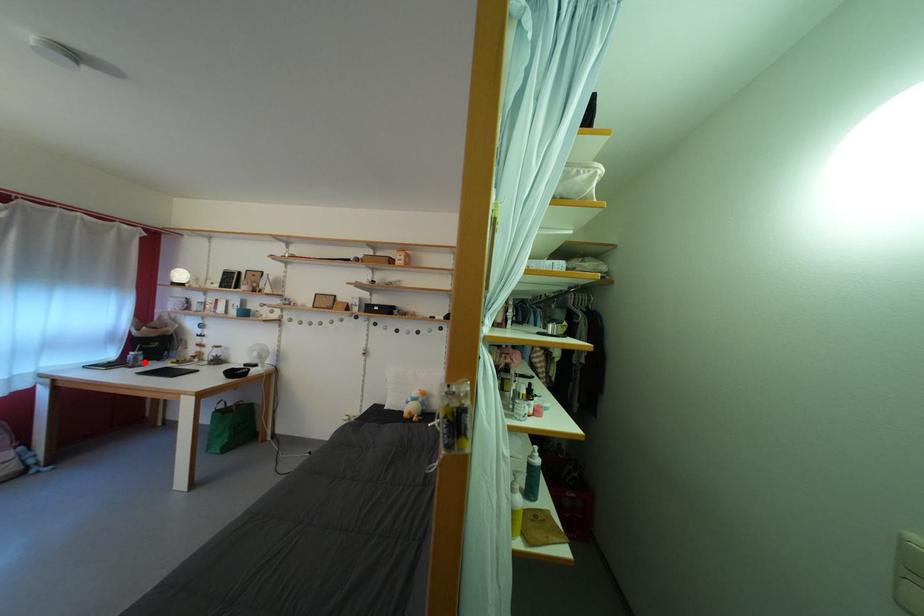
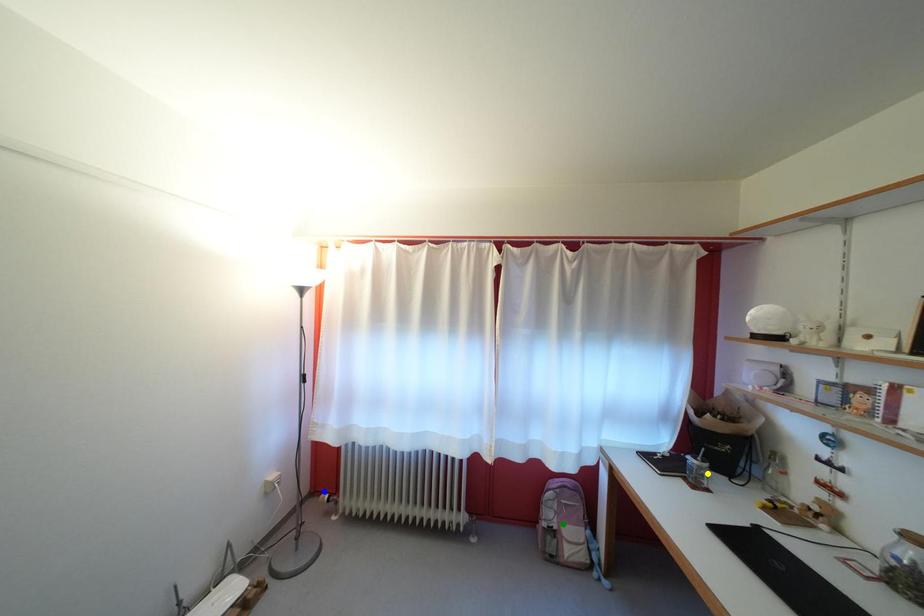
Question: I am providing you with two images of the same scene from different viewpoints. A red point is marked on the first image. You are given multiple points on the second image. In image 2, which mark is for the same physical point as the one in image 1?

Choices:
 (A) green point
 (B) blue point
 (C) yellow point

Answer: (C)